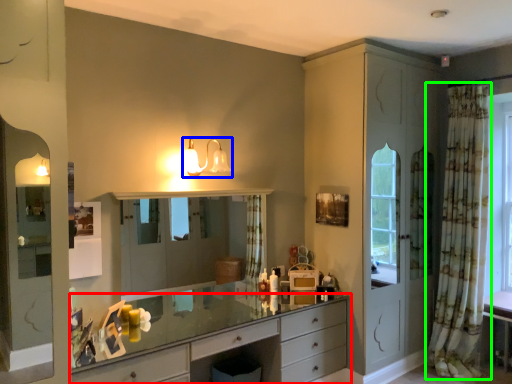
Question: Which is farther away from chest of drawers (highlighted by a red box)? light fixture (highlighted by a blue box) or curtain (highlighted by a green box)?

Choices:
 (A) light fixture
 (B) curtain

Answer: (B)